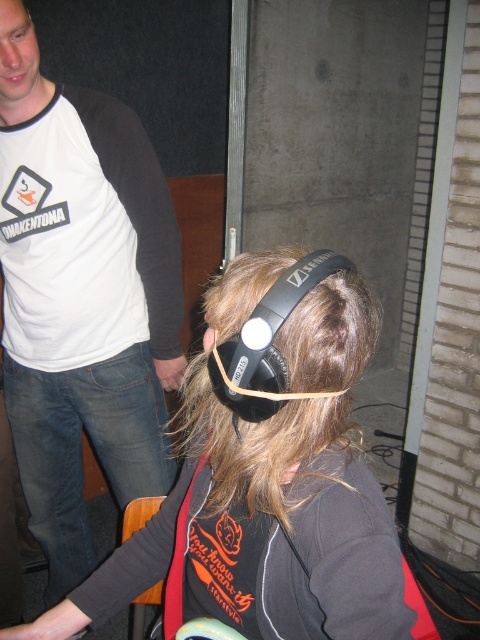
You are trying to place a new poster on the wall behind the two people. The poster is 1.2 meters wide. There is a space between the black matte headphones at center and the black matte headphones at upper center. Can the poster fit in that space horizontally?

The black matte headphones at center might be wider than the black matte headphones at upper center, but the description does not provide specific measurements for the width of the space between them. Without knowing the exact distance, it is uncertain if the 1.2 meter wide poster can fit horizontally in that space.

You are a delivery robot with a height of 1.2 meters. You are approaching the point at coordinates (190, 609) in the image. The scene shows two people in an indoor setting. The first person is seated with headphones, and the second is standing behind them. Will you collide with the standing person if you move to that point?

The distance of point (190, 609) from viewer is 94.90 centimeters. Since the standing person is behind the seated individual, the distance to the standing person would be greater than 94.90 cm. The robot is 1.2 meters tall, but the vertical position isn not specified. Assuming the robot moves forward to the point, it may not collide with the standing person if the distance is sufficient. However, without knowing the exact vertical placement, collision risk can not be fully determined.